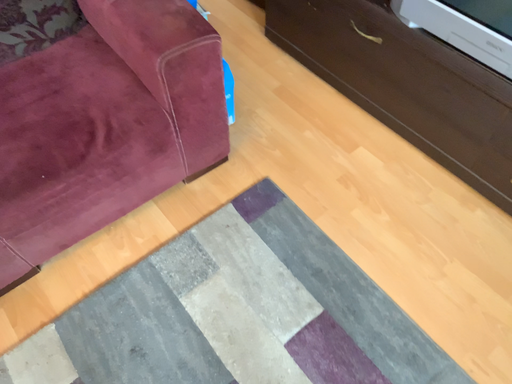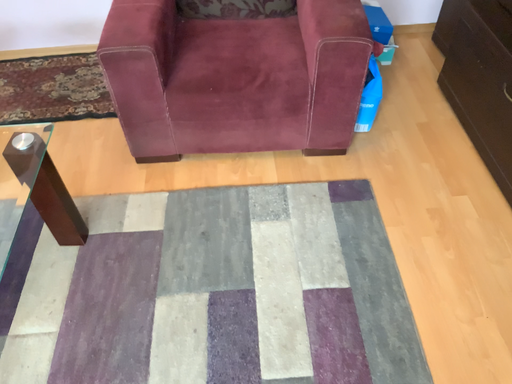
Question: Which way did the camera rotate in the video?

Choices:
 (A) rotated downward
 (B) rotated upward

Answer: (B)